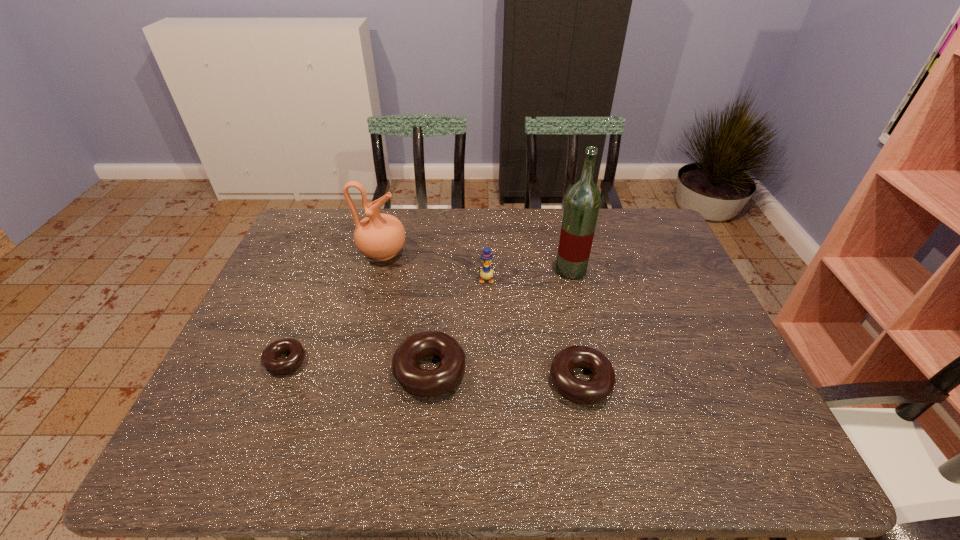
Please point a free position for a doughnut on the right. Please provide its 2D coordinates. Your answer should be formatted as a tuple, i.e. [(x, y)], where the tuple contains the x and y coordinates of a point satisfying the conditions above.

[(738, 393)]